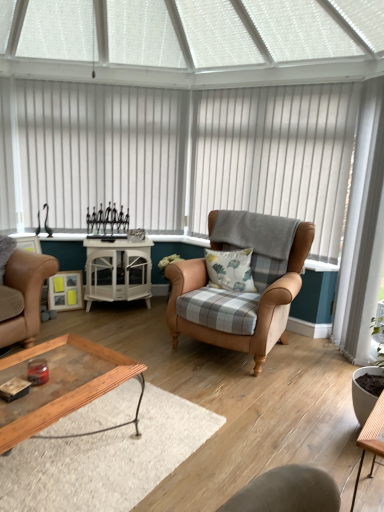
Question: Can you confirm if white vertical blinds at upper center, the first blind when ordered from left to right, is positioned to the right of white vertical blinds at center, placed as the 1th blind when sorted from right to left?

Choices:
 (A) yes
 (B) no

Answer: (B)

Question: Does white vertical blinds at upper center, marked as the 2th blind in a right-to-left arrangement, have a larger size compared to white vertical blinds at center, placed as the 1th blind when sorted from right to left?

Choices:
 (A) yes
 (B) no

Answer: (B)

Question: Considering the relative positions of white vertical blinds at upper center, marked as the 2th blind in a right-to-left arrangement, and white vertical blinds at center, positioned as the 2th blind in left-to-right order, in the image provided, is white vertical blinds at upper center, marked as the 2th blind in a right-to-left arrangement, to the left of white vertical blinds at center, positioned as the 2th blind in left-to-right order, from the viewer's perspective?

Choices:
 (A) no
 (B) yes

Answer: (B)

Question: Are white vertical blinds at upper center, the first blind when ordered from left to right, and white vertical blinds at center, positioned as the 2th blind in left-to-right order, beside each other?

Choices:
 (A) no
 (B) yes

Answer: (A)

Question: From the image's perspective, is white vertical blinds at upper center, the first blind when ordered from left to right, above white vertical blinds at center, positioned as the 2th blind in left-to-right order?

Choices:
 (A) yes
 (B) no

Answer: (A)

Question: From a real-world perspective, is white vertical blinds at upper center, the first blind when ordered from left to right, on white vertical blinds at center, placed as the 1th blind when sorted from right to left?

Choices:
 (A) yes
 (B) no

Answer: (A)

Question: Is white vertical blinds at upper center, the first blind when ordered from left to right, wider than wooden tray at lower center?

Choices:
 (A) no
 (B) yes

Answer: (A)

Question: Is white vertical blinds at upper center, marked as the 2th blind in a right-to-left arrangement, facing towards wooden tray at lower center?

Choices:
 (A) yes
 (B) no

Answer: (A)

Question: Is wooden tray at lower center a part of white vertical blinds at upper center, marked as the 2th blind in a right-to-left arrangement?

Choices:
 (A) no
 (B) yes

Answer: (A)

Question: From the image's perspective, does white vertical blinds at upper center, the first blind when ordered from left to right, appear lower than wooden tray at lower center?

Choices:
 (A) yes
 (B) no

Answer: (B)

Question: From a real-world perspective, is white vertical blinds at upper center, marked as the 2th blind in a right-to-left arrangement, physically above wooden tray at lower center?

Choices:
 (A) no
 (B) yes

Answer: (B)

Question: Does white vertical blinds at upper center, the first blind when ordered from left to right, have a lesser width compared to wooden tray at lower center?

Choices:
 (A) no
 (B) yes

Answer: (B)

Question: Is leather armchair at center taller than fluffy cotton pillow at center?

Choices:
 (A) yes
 (B) no

Answer: (A)